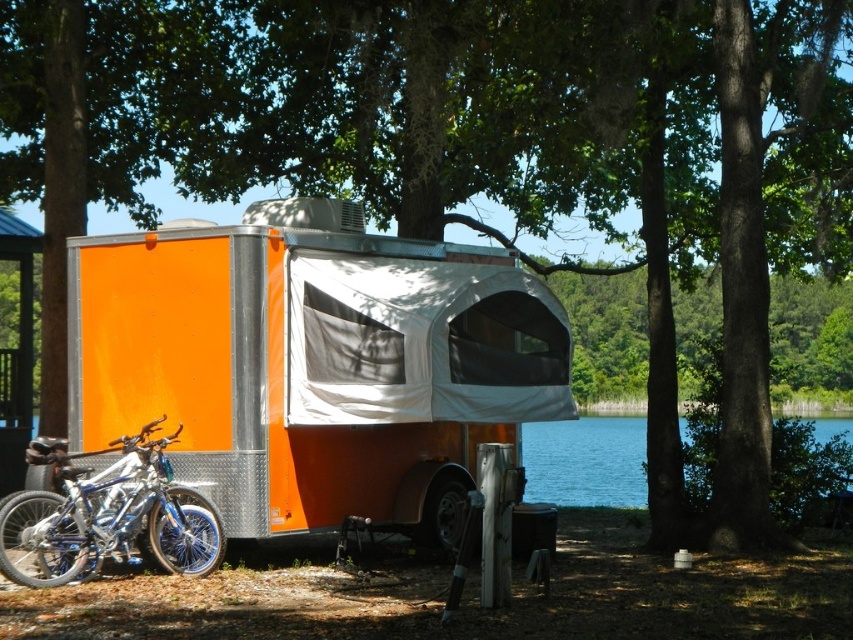
Find the location of a particular element. This screenshot has height=640, width=853. orange metallic camper at center is located at coordinates (312, 362).

Does orange metallic camper at center appear under blue water at lower center?

No, orange metallic camper at center is not below blue water at lower center.

Can you confirm if orange metallic camper at center is shorter than blue water at lower center?

No.

Locate an element on the screen. orange metallic camper at center is located at coordinates (312, 362).

I want to click on orange metallic camper at center, so click(312, 362).

Which is in front, point (61, 550) or point (573, 492)?

Positioned in front is point (61, 550).

Which of these two, shiny blue metallic bicycle at lower left or blue water at lower center, stands shorter?

Standing shorter between the two is shiny blue metallic bicycle at lower left.

Is point (107, 550) positioned after point (640, 472)?

No, it is in front of (640, 472).

Image resolution: width=853 pixels, height=640 pixels. Identify the location of shiny blue metallic bicycle at lower left. (107, 516).